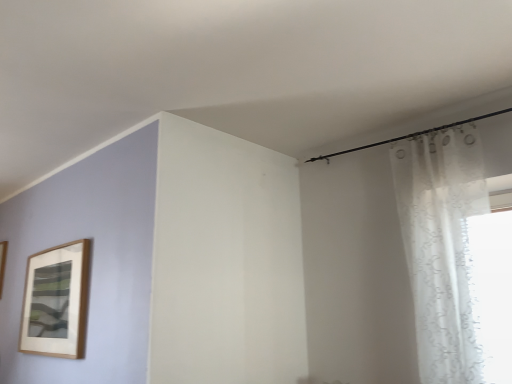
Question: Does wooden picture frame at left have a smaller size compared to white sheer curtain at right?

Choices:
 (A) yes
 (B) no

Answer: (A)

Question: Does wooden picture frame at left have a greater width compared to white sheer curtain at right?

Choices:
 (A) no
 (B) yes

Answer: (A)

Question: From the image's perspective, is wooden picture frame at left beneath white sheer curtain at right?

Choices:
 (A) yes
 (B) no

Answer: (A)

Question: Is wooden picture frame at left turned away from white sheer curtain at right?

Choices:
 (A) no
 (B) yes

Answer: (A)

Question: Is wooden picture frame at left shorter than white sheer curtain at right?

Choices:
 (A) no
 (B) yes

Answer: (B)

Question: Are wooden picture frame at left and white sheer curtain at right located far from each other?

Choices:
 (A) yes
 (B) no

Answer: (A)

Question: From the image's perspective, would you say white sheer curtain at right is shown under wooden picture frame at left?

Choices:
 (A) yes
 (B) no

Answer: (B)

Question: Is wooden picture frame at left located within white sheer curtain at right?

Choices:
 (A) no
 (B) yes

Answer: (A)

Question: Would you say white sheer curtain at right is outside wooden picture frame at left?

Choices:
 (A) yes
 (B) no

Answer: (A)

Question: Is white sheer curtain at right facing away from wooden picture frame at left?

Choices:
 (A) yes
 (B) no

Answer: (B)

Question: From a real-world perspective, is white sheer curtain at right located beneath wooden picture frame at left?

Choices:
 (A) yes
 (B) no

Answer: (A)

Question: Is white sheer curtain at right further to camera compared to wooden picture frame at left?

Choices:
 (A) no
 (B) yes

Answer: (A)

Question: Is wooden picture frame at left in front of or behind white sheer curtain at right in the image?

Choices:
 (A) front
 (B) behind

Answer: (B)